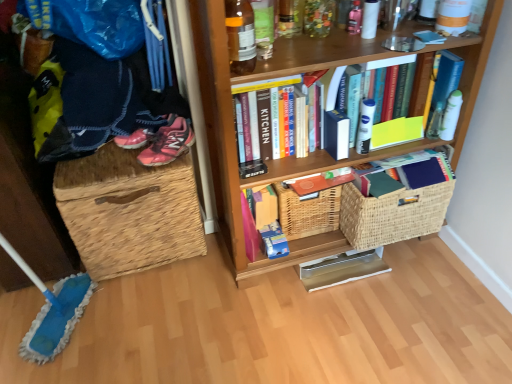
The height and width of the screenshot is (384, 512). Find the location of `vacant area on top of woven brown basket at center, the second basket viewed from the right (from a real-world perspective)`. vacant area on top of woven brown basket at center, the second basket viewed from the right (from a real-world perspective) is located at coordinates (319, 177).